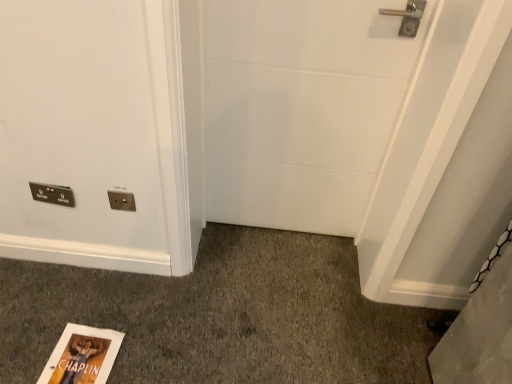
Question: Considering the relative positions of white matte door at center and matte gold electrical outlet at center in the image provided, is white matte door at center behind matte gold electrical outlet at center?

Choices:
 (A) no
 (B) yes

Answer: (A)

Question: Is matte gold electrical outlet at center a part of white matte door at center?

Choices:
 (A) yes
 (B) no

Answer: (B)

Question: Would you consider white matte door at center to be distant from matte gold electrical outlet at center?

Choices:
 (A) yes
 (B) no

Answer: (B)

Question: From the image's perspective, is white matte door at center over matte gold electrical outlet at center?

Choices:
 (A) yes
 (B) no

Answer: (A)

Question: Is the position of white matte door at center less distant than that of matte gold electrical outlet at center?

Choices:
 (A) no
 (B) yes

Answer: (B)

Question: Is point (122, 206) closer or farther from the camera than point (254, 211)?

Choices:
 (A) farther
 (B) closer

Answer: (B)

Question: In the image, is matte gold electrical outlet at center positioned in front of or behind white matte door at center?

Choices:
 (A) front
 (B) behind

Answer: (B)

Question: From the image's perspective, relative to white matte door at center, is matte gold electrical outlet at center above or below?

Choices:
 (A) below
 (B) above

Answer: (A)

Question: Visually, is matte gold electrical outlet at center positioned to the left or to the right of white matte door at center?

Choices:
 (A) left
 (B) right

Answer: (A)

Question: Considering the positions of white matte door at center and matte gold electrical outlet at center in the image, is white matte door at center bigger or smaller than matte gold electrical outlet at center?

Choices:
 (A) small
 (B) big

Answer: (B)

Question: From a real-world perspective, relative to matte gold electrical outlet at center, is white matte door at center vertically above or below?

Choices:
 (A) above
 (B) below

Answer: (A)

Question: From the image's perspective, is white matte door at center positioned above or below matte gold electrical outlet at center?

Choices:
 (A) above
 (B) below

Answer: (A)

Question: From their relative heights in the image, would you say white matte door at center is taller or shorter than matte gold electrical outlet at center?

Choices:
 (A) tall
 (B) short

Answer: (A)

Question: Relative to metallic silver light switch at lower left, is white matte door at center in front or behind?

Choices:
 (A) behind
 (B) front

Answer: (B)

Question: Looking at the image, does white matte door at center seem bigger or smaller compared to metallic silver light switch at lower left?

Choices:
 (A) big
 (B) small

Answer: (A)